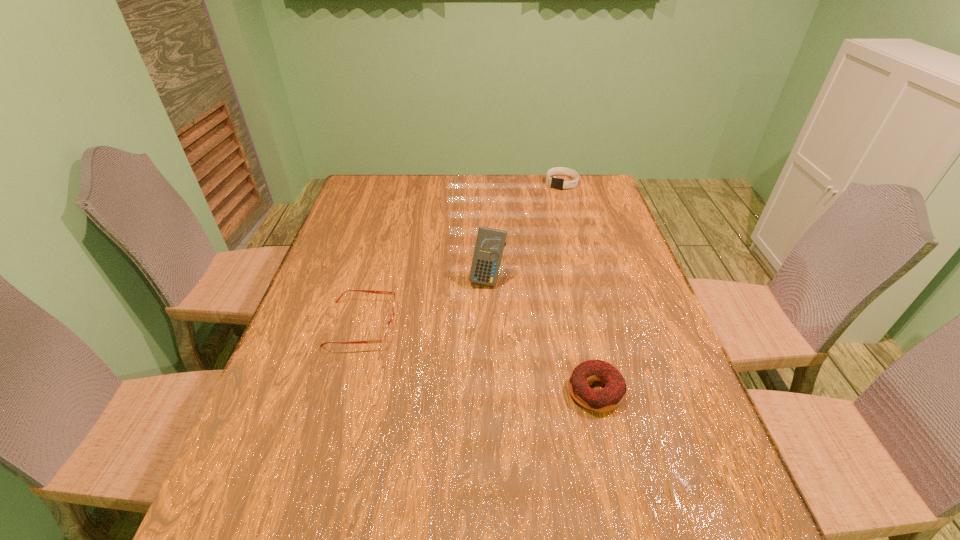
At what (x,y) coordinates should I click in order to perform the action: click on vacant space that is in between the tallest object and the nearest object. Please return your answer as a coordinate pair (x, y). The height and width of the screenshot is (540, 960). Looking at the image, I should click on (541, 335).

You are a GUI agent. You are given a task and a screenshot of the screen. Output one action in this format:
    pyautogui.click(x=<x>, y=<y>)
    Task: Click on the free space that is in between the spectacles and the farthest object
    This screenshot has height=540, width=960.
    Given the screenshot: What is the action you would take?
    pyautogui.click(x=462, y=253)

Identify the location of vacant space that's between the second nearest object and the wristband. coord(462,253).

What are the coordinates of `vacant region between the third farthest object and the farthest object` in the screenshot? It's located at (462, 253).

Find the location of `object that is the nearest to the third farthest object`. object that is the nearest to the third farthest object is located at coordinates (490, 243).

Locate an element on the screen. The image size is (960, 540). object that is the second closest one to the doughnut is located at coordinates (388, 331).

This screenshot has height=540, width=960. What are the coordinates of `vacant space that satisfies the following two spatial constraints: 1. on the front side of the tallest object; 2. on the left side of the nearest object` in the screenshot? It's located at point(490,392).